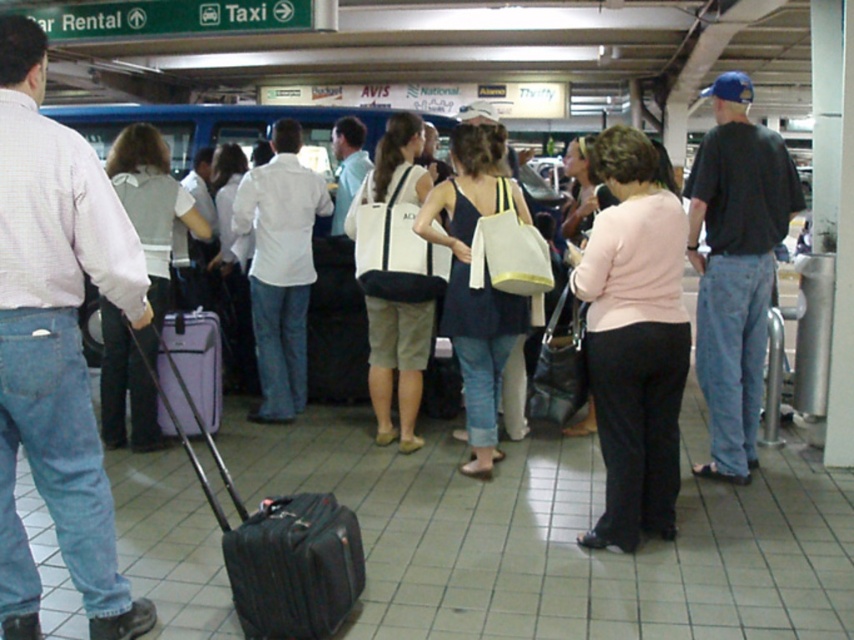
You are a traveler who just arrived at the airport and need to identify your belongings. You see a light pink sweater at center and a black leather suitcase at center. Which item is taller?

The light pink sweater at center is taller than the black leather suitcase at center.

Based on the photo, you are a traveler who wants to pack your light pink sweater at center into your black fabric suitcase at center. Based on the scene description, will the sweater fit inside the suitcase?

The light pink sweater at center is larger in size than the black fabric suitcase at center, so the sweater will not fit inside the suitcase.